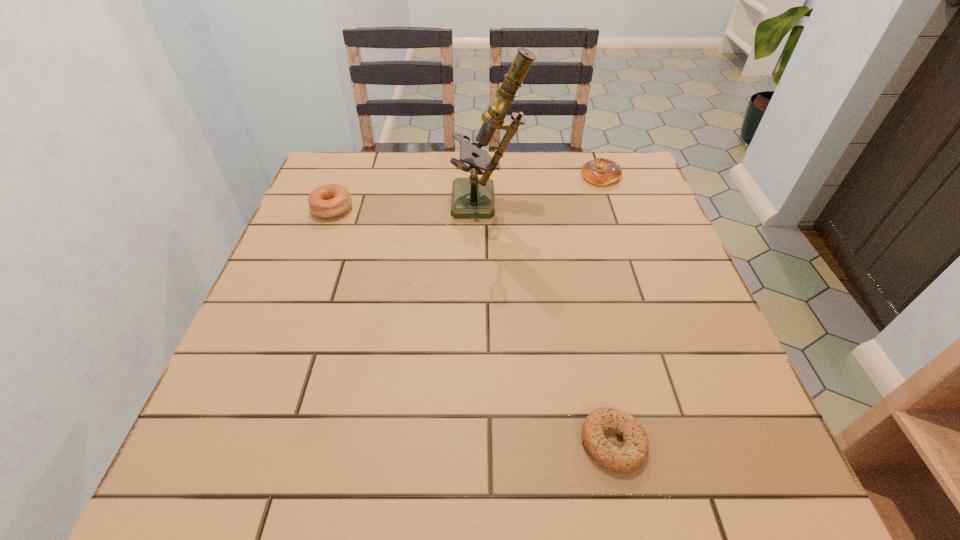
Find the location of a particular element. The height and width of the screenshot is (540, 960). vacant region located at the eyepiece of the tallest object is located at coordinates (402, 204).

Where is `free space located on the front of the third shortest object`? The width and height of the screenshot is (960, 540). free space located on the front of the third shortest object is located at coordinates (312, 264).

Find the location of a particular element. The height and width of the screenshot is (540, 960). free space located on the front of the farthest bagel is located at coordinates (624, 245).

Where is `vacant space located on the back of the second bagel from right to left`? The image size is (960, 540). vacant space located on the back of the second bagel from right to left is located at coordinates (576, 269).

Find the location of a particular element. microscope that is positioned at the far edge is located at coordinates (471, 197).

I want to click on object at the near edge, so click(x=632, y=454).

I want to click on object located in the left edge section of the desktop, so click(x=327, y=201).

You are a GUI agent. You are given a task and a screenshot of the screen. Output one action in this format:
    pyautogui.click(x=<x>, y=<y>)
    Task: Click on the object that is at the right edge
    This screenshot has width=960, height=540.
    Given the screenshot: What is the action you would take?
    pyautogui.click(x=602, y=171)

Find the location of `object located at the far left corner`. object located at the far left corner is located at coordinates (327, 201).

This screenshot has height=540, width=960. I want to click on object present at the far right corner, so click(602, 171).